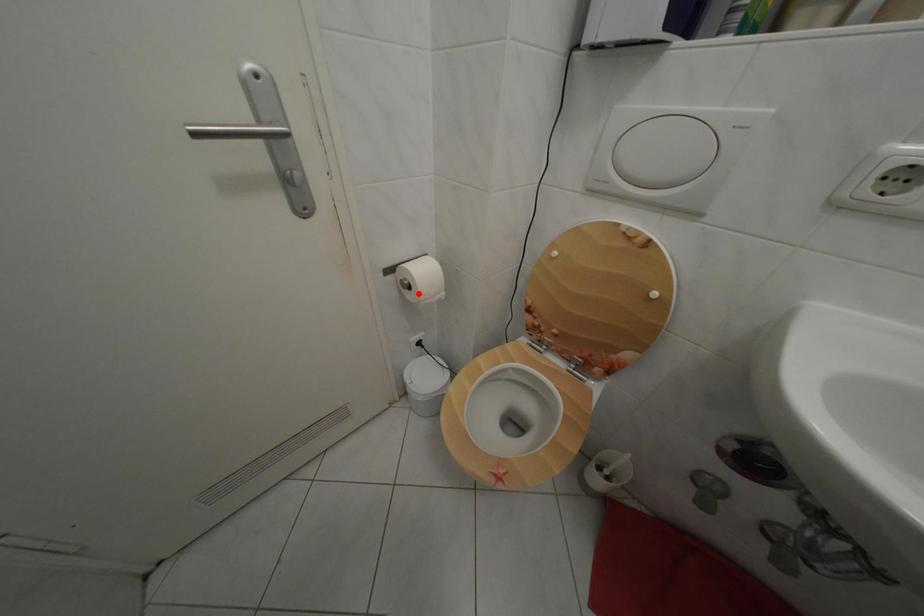
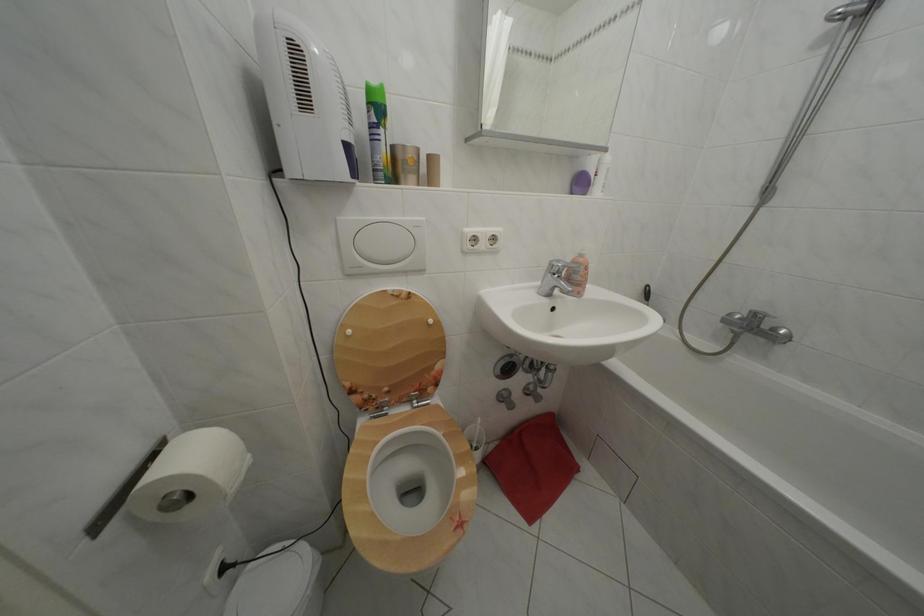
The point at the highlighted location is marked in the first image. Where is the corresponding point in the second image?

(198, 504)